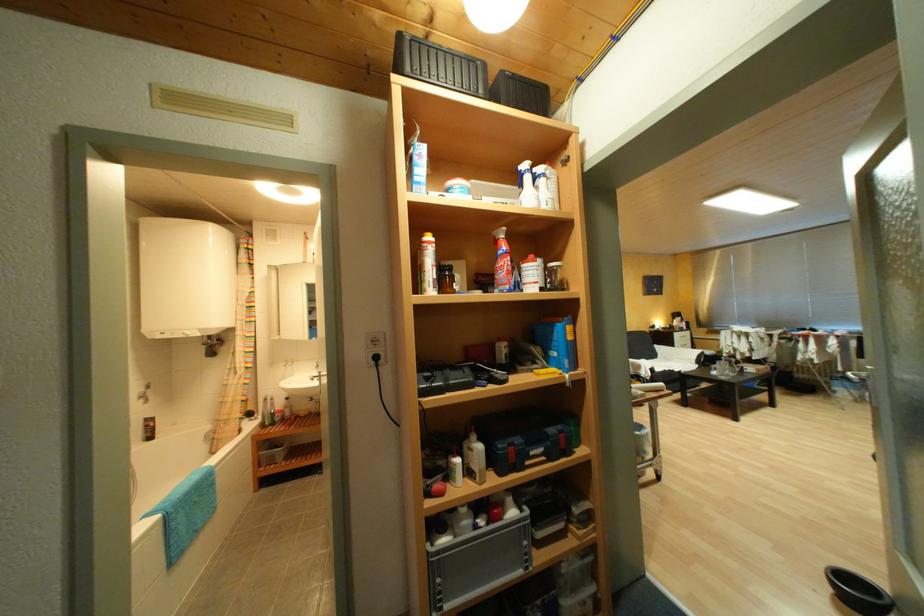
In order to click on spray can nozzle in this screenshot , I will do `click(810, 241)`.